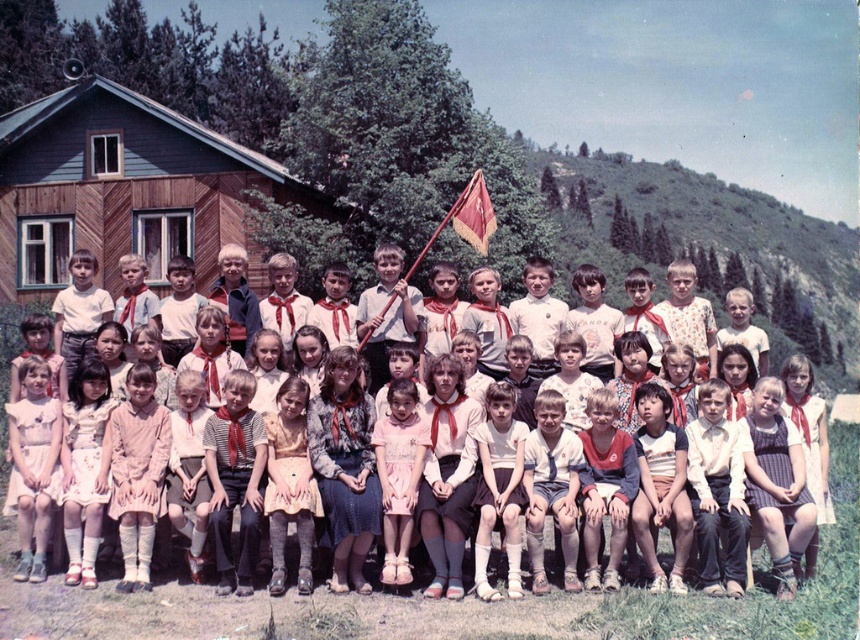
You are a photographer trying to capture a photo of the wooden cabin at upper left and the red velvet flag at center. Based on their sizes, which object should you focus on first to ensure it appears prominent in the photo?

The wooden cabin at upper left should be focused on first since it has a larger size compared to the red velvet flag at center, making it more prominent in the photo.

You are a photographer trying to capture a clear shot of the matte white dress at center and the red velvet flag at center. Based on their positions, which object is closer to the camera?

The matte white dress at center is located below the red velvet flag at center, meaning the red velvet flag at center is closer to the camera since it is positioned higher up.